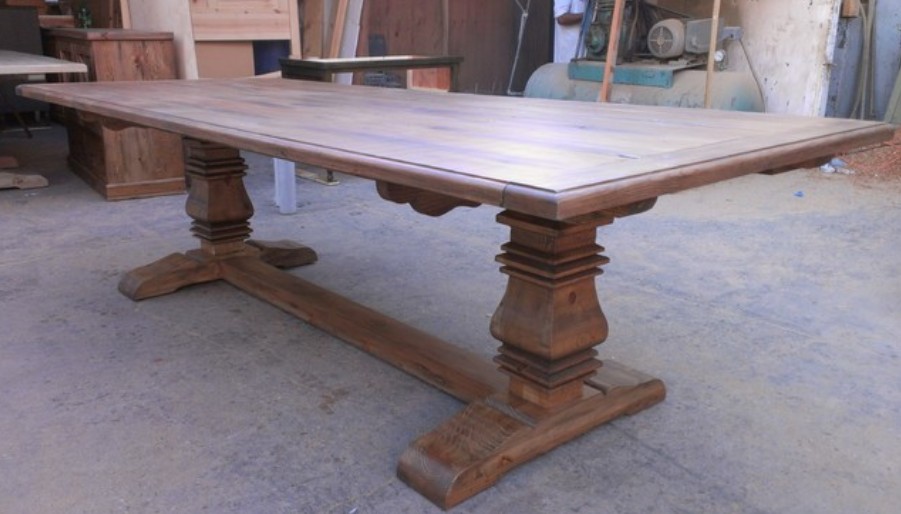
I want to click on dark brown wooden cabinet, so click(141, 59).